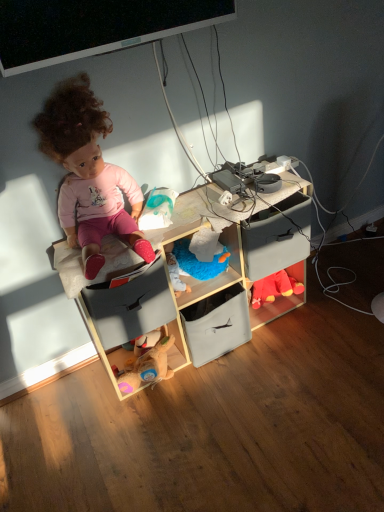
Locate an element on the screen. This screenshot has width=384, height=512. free space to the right of wooden cube at center, the second shelf from the right is located at coordinates point(331,331).